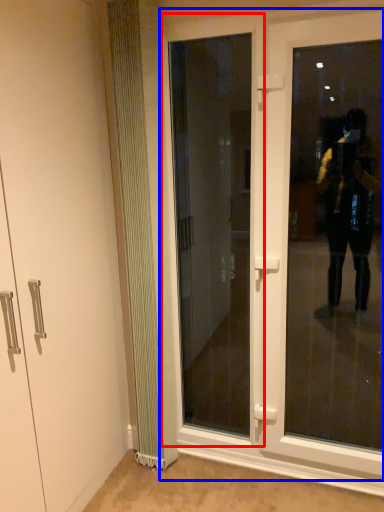
Question: Which of the following is the closest to the observer, door (highlighted by a red box) or door (highlighted by a blue box)?

Choices:
 (A) door
 (B) door

Answer: (B)